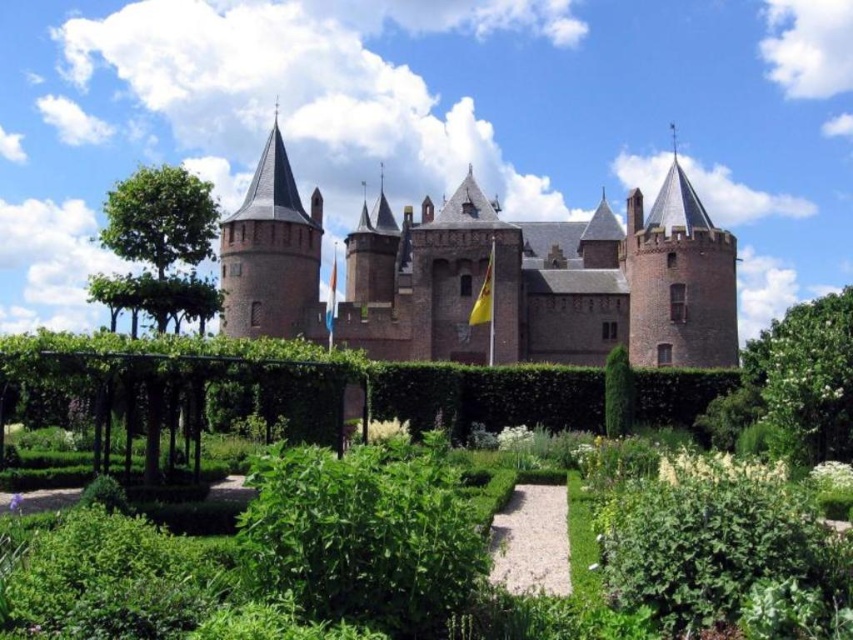
You are a visitor to the castle garden and want to know which plant is taller between the green leafy hedge at center and the green leafy tree at left. Can you tell me which one is taller?

The green leafy tree at left is taller than the green leafy hedge at center.

You are standing in the garden of the medieval castle and want to walk from the gravel path to the castle entrance. You notice two points marked in the image. Which point, point (277, 621) or point (300, 362), is closer to you as you stand at the gravel path?

Point (277, 621) is closer to the viewer than point (300, 362).